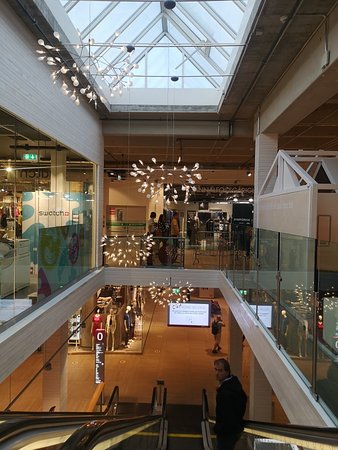
Identify the location of counter. (21, 266).